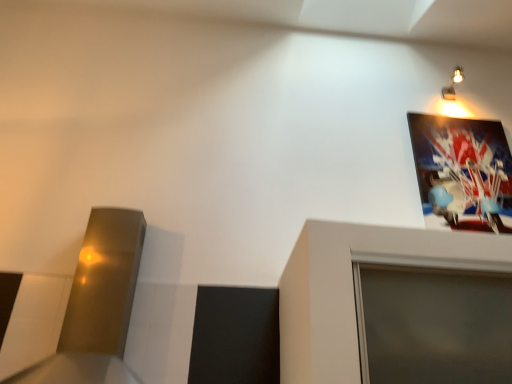
Question: Considering the positions of point (461, 77) and point (443, 132), is point (461, 77) closer or farther from the camera than point (443, 132)?

Choices:
 (A) closer
 (B) farther

Answer: (B)

Question: Is metallic wall sconce at upper right taller or shorter than metallic glossy picture frame at upper right?

Choices:
 (A) short
 (B) tall

Answer: (A)

Question: From the image's perspective, is metallic wall sconce at upper right located above or below metallic glossy picture frame at upper right?

Choices:
 (A) below
 (B) above

Answer: (B)

Question: Is metallic glossy picture frame at upper right to the left or to the right of metallic wall sconce at upper right in the image?

Choices:
 (A) left
 (B) right

Answer: (A)

Question: Is metallic glossy picture frame at upper right inside the boundaries of metallic wall sconce at upper right, or outside?

Choices:
 (A) outside
 (B) inside

Answer: (A)

Question: From a real-world perspective, relative to metallic wall sconce at upper right, is metallic glossy picture frame at upper right vertically above or below?

Choices:
 (A) above
 (B) below

Answer: (B)

Question: From their relative heights in the image, would you say metallic glossy picture frame at upper right is taller or shorter than metallic wall sconce at upper right?

Choices:
 (A) short
 (B) tall

Answer: (B)